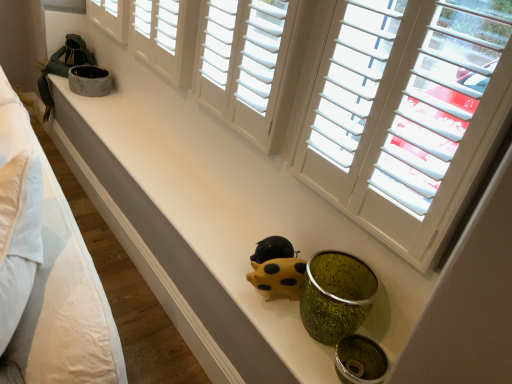
At what (x,y) coordinates should I click in order to perform the action: click on vacant point above matte white counter top at center (from a real-world perspective). Please return your answer as a coordinate pair (x, y). The image size is (512, 384). Looking at the image, I should click on coord(174,170).